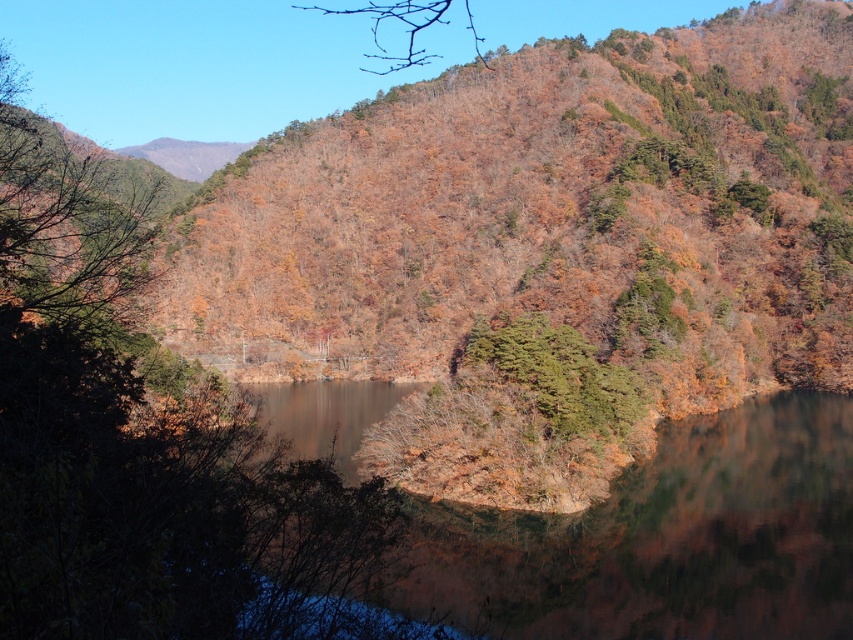
You are standing at the point marked as point (x=663, y=540) in the image. Looking around, you notice transparent water at center. Based on the scene description, what can you observe about the water at your current location?

The transparent water at center at point (x=663, y=540) is calm and acts as a mirror reflecting the autumnal forested hills and vibrant fall colors, creating a symmetrical and harmonious scene.

You are a drone operator trying to capture the reflection of the autumnal forest in the transparent water at center. According to the coordinates provided, where should you position your drone to ensure it captures the reflection clearly?

The transparent water at center is located at coordinates point (663, 540), so positioning the drone at that point will ensure it captures the reflection clearly.